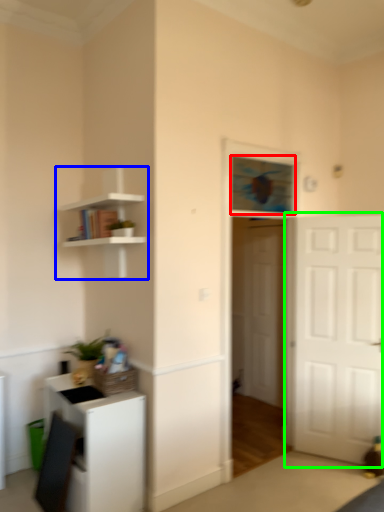
Question: Considering the real-world distances, which object is closest to window (highlighted by a red box)? shelf (highlighted by a blue box) or door (highlighted by a green box).

Choices:
 (A) shelf
 (B) door

Answer: (B)